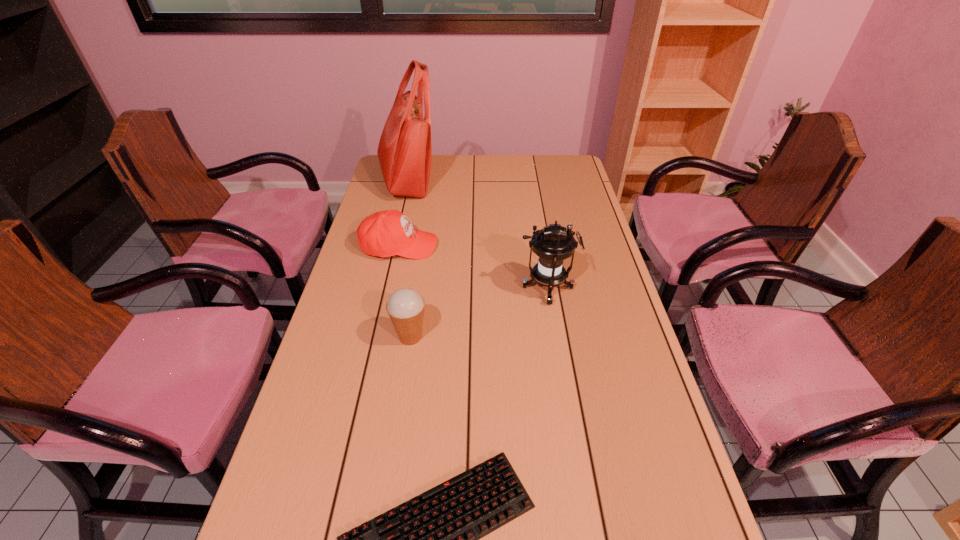
In the image, there is a desktop. What are the coordinates of `free region at the far left corner` in the screenshot? It's located at (383, 179).

Locate an element on the screen. vacant region at the far right corner is located at coordinates (568, 165).

You are a GUI agent. You are given a task and a screenshot of the screen. Output one action in this format:
    pyautogui.click(x=<x>, y=<y>)
    Task: Click on the free point between the fourth shortest object and the baseball cap
    The height and width of the screenshot is (540, 960).
    Given the screenshot: What is the action you would take?
    pyautogui.click(x=473, y=267)

Locate an element on the screen. vacant space that is in between the farthest object and the fourth farthest object is located at coordinates (409, 259).

The image size is (960, 540). In order to click on free space between the handbag and the fourth farthest object in this screenshot , I will do `click(409, 259)`.

Locate which object is the closest to the tallest object. Please provide its 2D coordinates. Your answer should be formatted as a tuple, i.e. [(x, y)], where the tuple contains the x and y coordinates of a point satisfying the conditions above.

[(386, 233)]

I want to click on object that is the nearest to the shortest object, so click(x=405, y=307).

Identify the location of vacant region that satisfies the following two spatial constraints: 1. on the back side of the fourth shortest object; 2. on the front-facing side of the handbag. Image resolution: width=960 pixels, height=540 pixels. (529, 181).

In order to click on free spot that satisfies the following two spatial constraints: 1. on the back side of the icecream; 2. on the left side of the rightmost object in this screenshot , I will do `click(418, 288)`.

Image resolution: width=960 pixels, height=540 pixels. Identify the location of free space that satisfies the following two spatial constraints: 1. on the front panel of the baseball cap; 2. on the left side of the second nearest object. (379, 337).